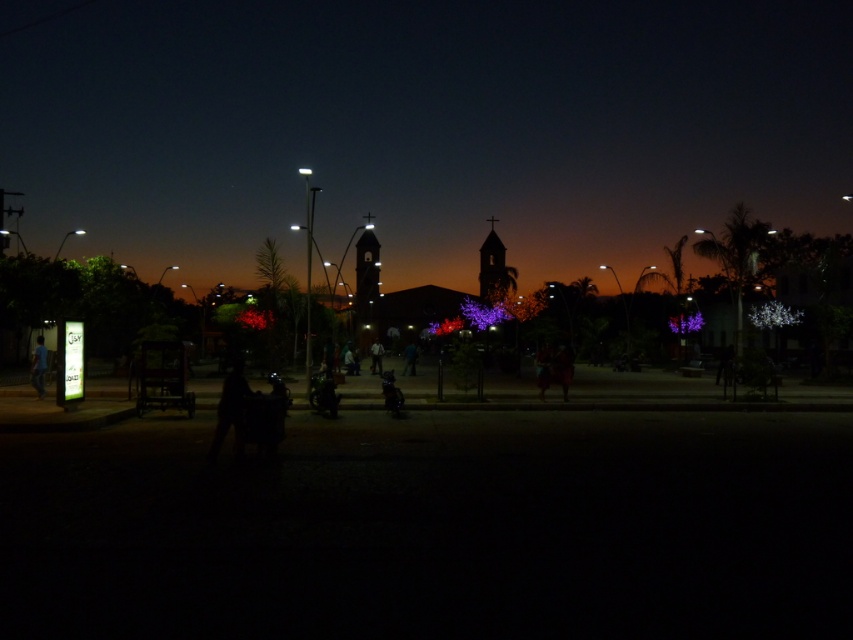
You are an architect reviewing blueprints for a new town square. The design includes two central bell towers, the matte glass bell tower at center and the matte brown bell tower at center. According to the provided scene, which tower has a greater width?

The matte glass bell tower at center has a greater width than the matte brown bell tower at center as stated in the Objects Description.

You are standing on the street in the scene and want to know if the matte glass bell tower at center is wider than the blue fabric person at lower left. Can you determine this based on the scene?

The matte glass bell tower at center is wider than the blue fabric person at lower left according to the description.